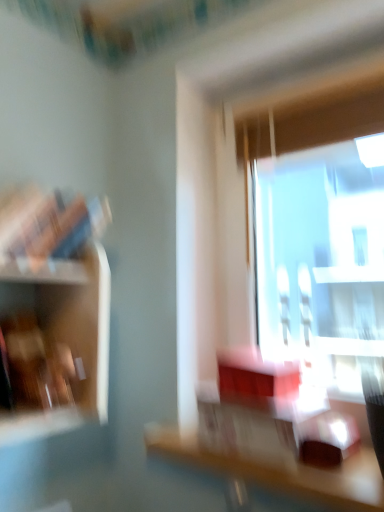
The width and height of the screenshot is (384, 512). Describe the element at coordinates (52, 324) in the screenshot. I see `wooden shelf at left` at that location.

Find the location of a particular element. wooden shelf at left is located at coordinates (52, 324).

In order to face wooden table at center, should I rotate leftwards or rightwards?

Rotate right and turn 10.630 degrees.

The height and width of the screenshot is (512, 384). Describe the element at coordinates (271, 462) in the screenshot. I see `wooden table at center` at that location.

You are a GUI agent. You are given a task and a screenshot of the screen. Output one action in this format:
    pyautogui.click(x=<x>, y=<y>)
    Task: Click on the wooden table at center
    
    Given the screenshot: What is the action you would take?
    pyautogui.click(x=271, y=462)

Identify the location of wooden shelf at left. (52, 324).

Which object is positioned more to the right, wooden table at center or wooden shelf at left?

wooden table at center is more to the right.

Which object is further away from the camera taking this photo, wooden table at center or wooden shelf at left?

Positioned behind is wooden shelf at left.

Is point (378, 510) less distant than point (13, 286)?

Yes, point (378, 510) is closer to viewer.

From the image's perspective, which one is positioned lower, wooden table at center or wooden shelf at left?

From the image's view, wooden table at center is below.

From a real-world perspective, which object rests below the other?

wooden table at center is physically lower.

Is wooden table at center wider or thinner than wooden shelf at left?

wooden table at center is wider than wooden shelf at left.

Who is shorter, wooden table at center or wooden shelf at left?

Standing shorter between the two is wooden table at center.

Which of these two, wooden table at center or wooden shelf at left, is bigger?

wooden shelf at left.

From the picture: Would you say wooden table at center is inside or outside wooden shelf at left?

wooden table at center is not enclosed by wooden shelf at left.

Is wooden table at center not close to wooden shelf at left?

No, there isn't a large distance between wooden table at center and wooden shelf at left.

From the picture: Is wooden table at center oriented away from wooden shelf at left?

No, wooden table at center is not facing the opposite direction of wooden shelf at left.

Measure the distance from wooden table at center to wooden shelf at left.

wooden table at center and wooden shelf at left are 15.09 inches apart.

Locate an element on the screen. The image size is (384, 512). shelf located above the wooden table at center (from the image's perspective) is located at coordinates (52, 324).

Which is more to the right, wooden shelf at left or wooden table at center?

From the viewer's perspective, wooden table at center appears more on the right side.

Relative to wooden table at center, is wooden shelf at left in front or behind?

Clearly, wooden shelf at left is behind wooden table at center.

Which point is more forward, [17,360] or [257,422]?

The point [257,422] is closer to the camera.

Based on the photo, from the image's perspective, is wooden shelf at left below wooden table at center?

No.

From a real-world perspective, does wooden shelf at left stand above wooden table at center?

Indeed, from a real-world perspective, wooden shelf at left stands above wooden table at center.

Between wooden shelf at left and wooden table at center, which one has larger width?

Wider between the two is wooden table at center.

Is wooden shelf at left shorter than wooden table at center?

Incorrect, the height of wooden shelf at left does not fall short of that of wooden table at center.

Considering the sizes of objects wooden shelf at left and wooden table at center in the image provided, who is smaller, wooden shelf at left or wooden table at center?

wooden table at center is smaller.

Would you say wooden table at center is part of wooden shelf at left's contents?

Actually, wooden table at center is outside wooden shelf at left.

Is wooden shelf at left next to wooden table at center and touching it?

wooden shelf at left and wooden table at center are clearly separated.

Is wooden shelf at left looking in the opposite direction of wooden table at center?

No, wooden shelf at left is not facing away from wooden table at center.

What's the angular difference between wooden shelf at left and wooden table at center's facing directions?

wooden shelf at left and wooden table at center are facing 89.5 degrees away from each other.

Locate an element on the screen. The height and width of the screenshot is (512, 384). shelf on the left of wooden table at center is located at coordinates (52, 324).

Locate an element on the screen. This screenshot has height=512, width=384. table below the wooden shelf at left (from the image's perspective) is located at coordinates (271, 462).

The width and height of the screenshot is (384, 512). I want to click on table to the right of wooden shelf at left, so click(x=271, y=462).